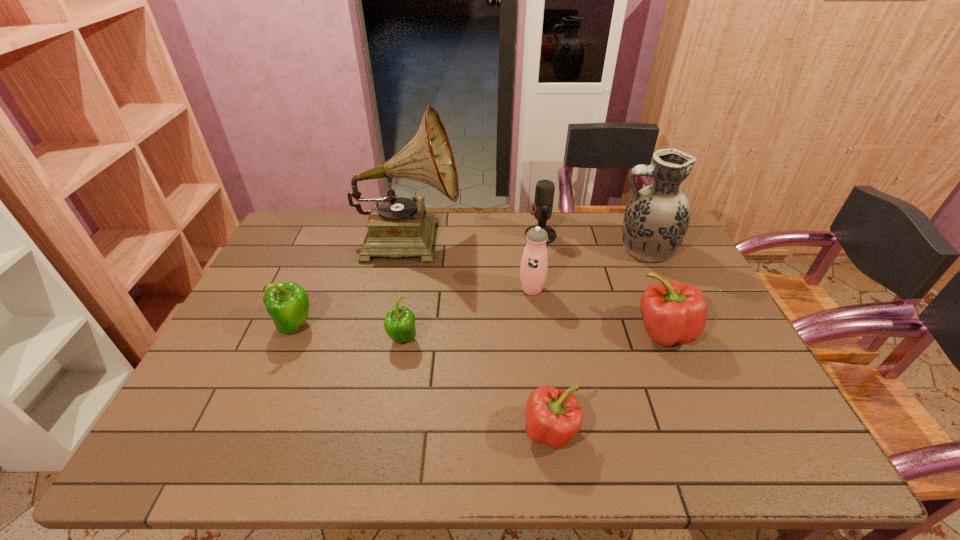
Identify the location of vacant space that satisfies the following two spatial constraints: 1. from the horn of the fourth farthest object; 2. on the left side of the record player. (398, 289).

At what (x,y) coordinates should I click in order to perform the action: click on free spot that satisfies the following two spatial constraints: 1. on the front side of the thermos bottle; 2. on the left side of the bigger pink bell pepper. Please return your answer as a coordinate pair (x, y). This screenshot has width=960, height=540. Looking at the image, I should click on (538, 332).

The height and width of the screenshot is (540, 960). I want to click on vacant position in the image that satisfies the following two spatial constraints: 1. on the back side of the fourth farthest object; 2. from the horn of the tallest object, so click(x=525, y=238).

Locate an element on the screen. This screenshot has width=960, height=540. vacant space that satisfies the following two spatial constraints: 1. from the horn of the record player; 2. on the left side of the smaller green bell pepper is located at coordinates (x=388, y=339).

In order to click on vacant space that satisfies the following two spatial constraints: 1. on the back side of the bigger green bell pepper; 2. on the left side of the fifth nearest object in this screenshot , I will do `click(311, 289)`.

What are the coordinates of `vacant area in the image that satisfies the following two spatial constraints: 1. with the handle on the side of the blue vase; 2. from the horn of the record player` in the screenshot? It's located at (639, 238).